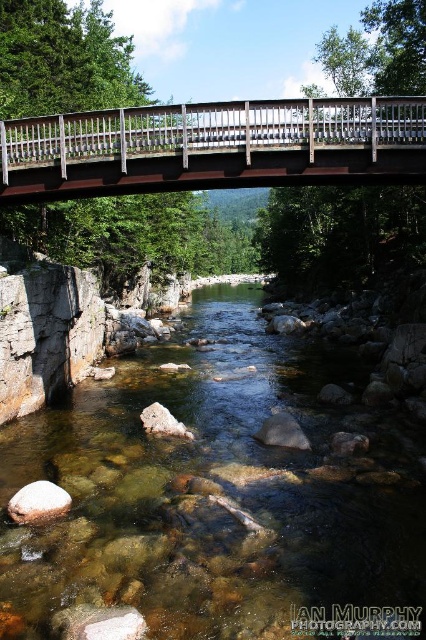
Looking at this image, does clear stone stream at center come behind brown wooden bridge at center?

No, it is in front of brown wooden bridge at center.

Measure the distance between point (287, 410) and camera.

A distance of 47.51 feet exists between point (287, 410) and camera.

Identify the location of clear stone stream at center. (222, 493).

Can you confirm if brown wooden bridge at center is shorter than white smooth rock at lower left?

Incorrect, brown wooden bridge at center's height does not fall short of white smooth rock at lower left's.

Is brown wooden bridge at center taller than white smooth rock at lower left?

Indeed, brown wooden bridge at center has a greater height compared to white smooth rock at lower left.

Describe the element at coordinates (213, 147) in the screenshot. I see `brown wooden bridge at center` at that location.

Identify the location of brown wooden bridge at center. (213, 147).

Is point (210, 584) positioned after point (20, 499)?

That is False.

Does clear stone stream at center come behind white smooth rock at lower left?

No, it is in front of white smooth rock at lower left.

Is point (236, 561) behind point (42, 513)?

No.

The width and height of the screenshot is (426, 640). What are the coordinates of `clear stone stream at center` in the screenshot? It's located at (222, 493).